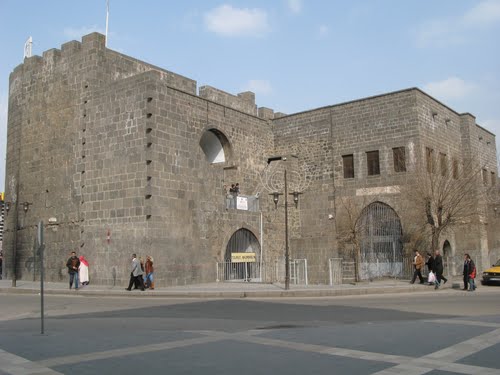
The width and height of the screenshot is (500, 375). In order to click on windows in this screenshot , I will do `click(350, 163)`, `click(371, 165)`, `click(399, 160)`, `click(430, 155)`, `click(442, 160)`, `click(458, 166)`, `click(484, 174)`, `click(488, 174)`.